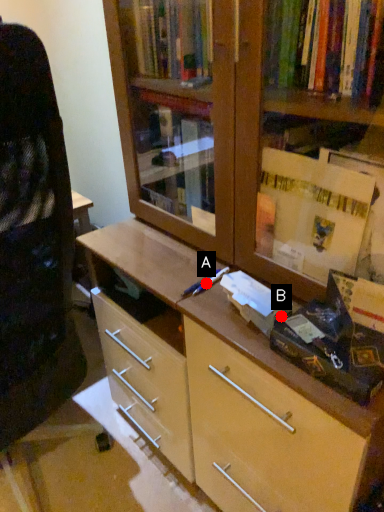
Question: Two points are circled on the image, labeled by A and B beside each circle. Which point is further to the camera?

Choices:
 (A) A is further
 (B) B is further

Answer: (A)